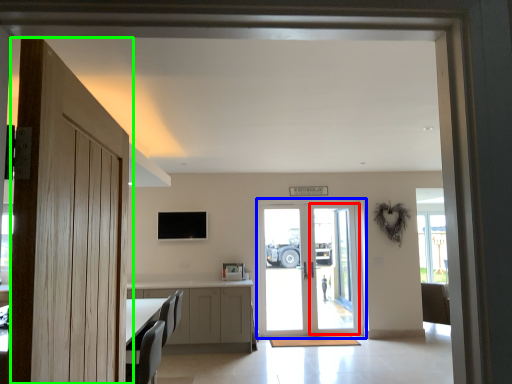
Question: Which is farther away from screen door (highlighted by a red box)? door (highlighted by a blue box) or door (highlighted by a green box)?

Choices:
 (A) door
 (B) door

Answer: (B)